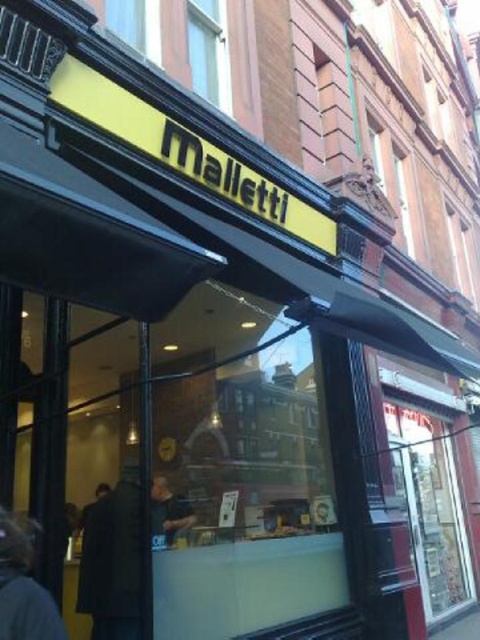
Which is more to the left, dark brown coat at center or dark brown leather jacket at lower left?

dark brown leather jacket at lower left is more to the left.

Does dark brown coat at center have a smaller size compared to dark brown leather jacket at lower left?

No.

Image resolution: width=480 pixels, height=640 pixels. Describe the element at coordinates (112, 561) in the screenshot. I see `dark brown coat at center` at that location.

Identify the location of dark brown coat at center. The height and width of the screenshot is (640, 480). (112, 561).